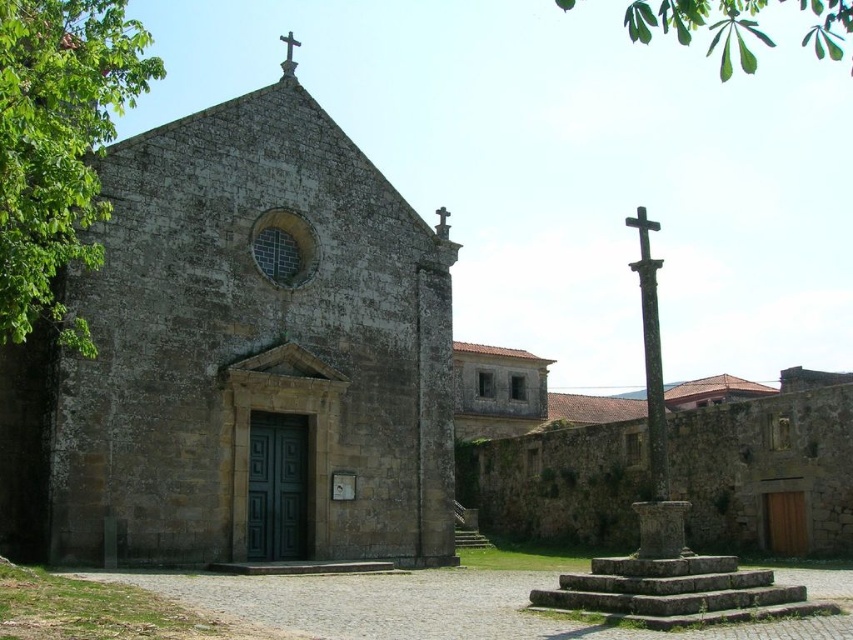
Question: Does stone church at center have a larger size compared to black wood cross at upper right?

Choices:
 (A) yes
 (B) no

Answer: (A)

Question: Which point appears farthest from the camera in this image?

Choices:
 (A) (641, 208)
 (B) (83, 460)

Answer: (B)

Question: Is stone church at center to the right of metallic cross at upper center from the viewer's perspective?

Choices:
 (A) no
 (B) yes

Answer: (B)

Question: Based on their relative distances, which object is nearer to the stone church at center?

Choices:
 (A) metallic cross at upper center
 (B) black wood cross at upper right

Answer: (A)

Question: Does stone church at center come behind black wood cross at upper right?

Choices:
 (A) no
 (B) yes

Answer: (B)

Question: Which of these objects is positioned farthest from the stone church at center?

Choices:
 (A) black wood cross at upper right
 (B) metallic cross at upper center

Answer: (A)